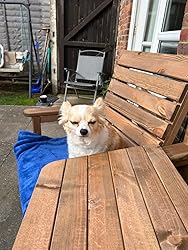
You are a GUI agent. You are given a task and a screenshot of the screen. Output one action in this format:
    pyautogui.click(x=<x>, y=<y>)
    Task: Click on the seats
    The height and width of the screenshot is (250, 188).
    Given the screenshot: What is the action you would take?
    pyautogui.click(x=150, y=116), pyautogui.click(x=91, y=63), pyautogui.click(x=13, y=68)